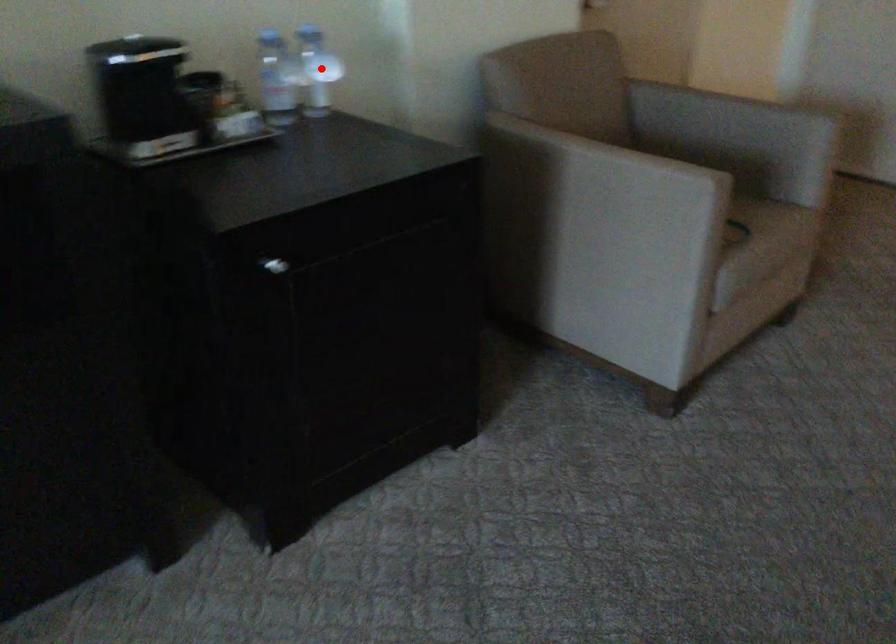
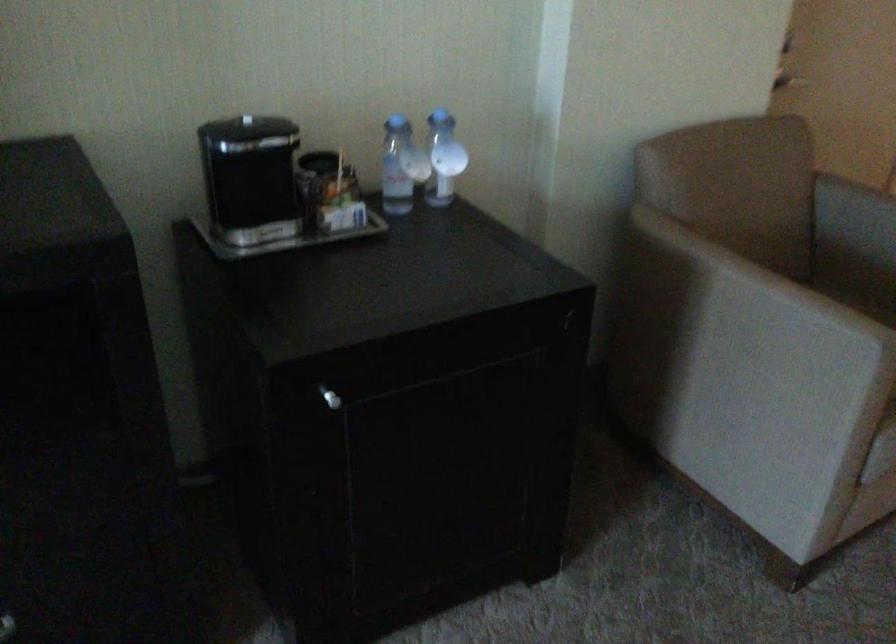
Find the pixel in the second image that matches the highlighted location in the first image.

(443, 158)